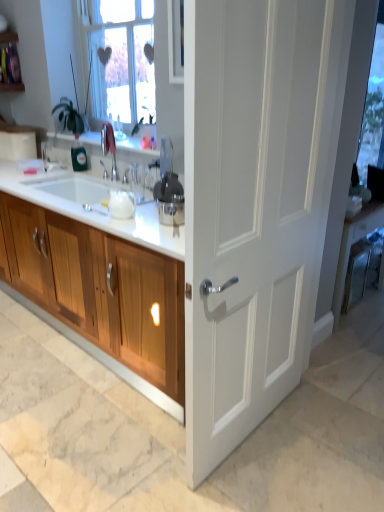
This screenshot has height=512, width=384. I want to click on vacant point to the right of white matte door at center, so click(315, 442).